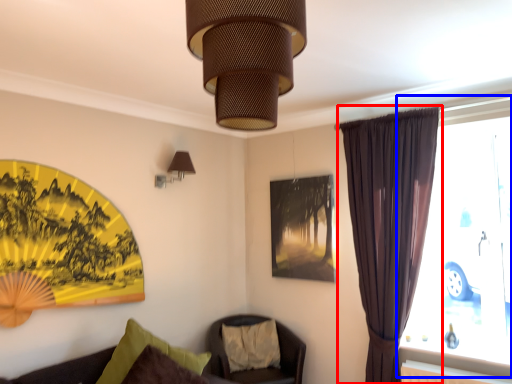
Question: Among these objects, which one is farthest to the camera, curtain (highlighted by a red box) or window (highlighted by a blue box)?

Choices:
 (A) curtain
 (B) window

Answer: (A)